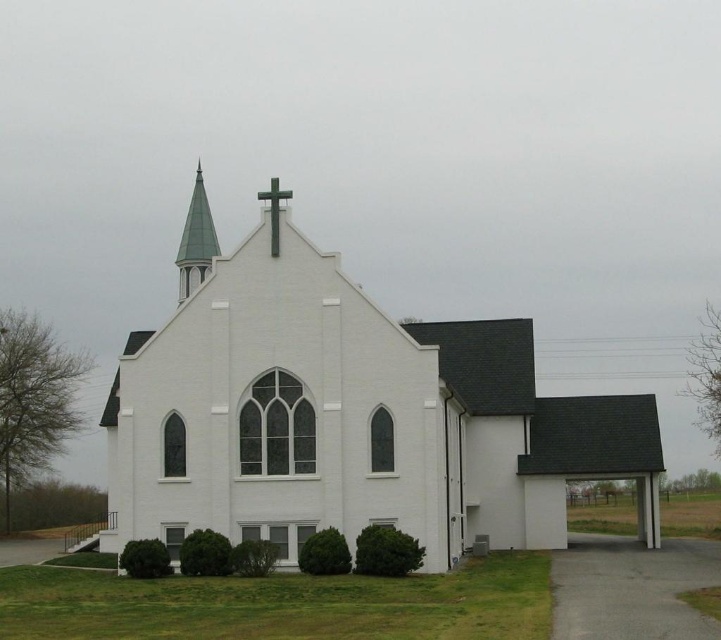
Does point (451, 371) lie behind point (262, 192)?

That is True.

Which is below, white matte church at center or green matte cross at upper center?

white matte church at center

This screenshot has height=640, width=721. What do you see at coordinates (350, 419) in the screenshot?
I see `white matte church at center` at bounding box center [350, 419].

At what (x,y) coordinates should I click in order to perform the action: click on white matte church at center. Please return your answer as a coordinate pair (x, y). Image resolution: width=721 pixels, height=640 pixels. Looking at the image, I should click on (350, 419).

Is green metallic spire at upper center positioned in front of green matte cross at upper center?

No, green metallic spire at upper center is behind green matte cross at upper center.

Measure the distance between green metallic spire at upper center and camera.

green metallic spire at upper center is 51.58 meters away from camera.

Identify the location of green metallic spire at upper center. Image resolution: width=721 pixels, height=640 pixels. (195, 241).

Is point (163, 442) closer to viewer compared to point (177, 257)?

That is True.

The width and height of the screenshot is (721, 640). Identify the location of white matte church at center. coord(350,419).